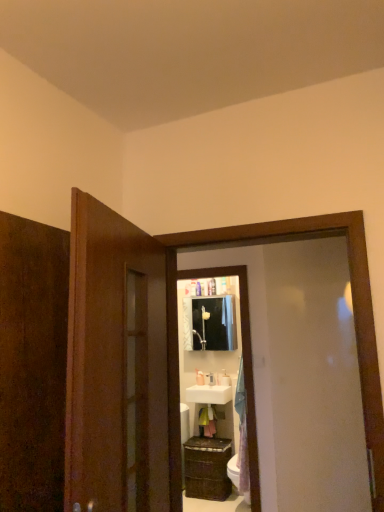
Question: Considering the positions of matte white medicine cabinet at center and white glossy sink at center in the image, is matte white medicine cabinet at center wider or thinner than white glossy sink at center?

Choices:
 (A) thin
 (B) wide

Answer: (A)

Question: From their relative heights in the image, would you say matte white medicine cabinet at center is taller or shorter than white glossy sink at center?

Choices:
 (A) tall
 (B) short

Answer: (A)

Question: Based on their relative distances, which object is farther from the white glossy toothbrush at upper center, which is counted as the third toiletry, starting from the left?

Choices:
 (A) white glossy soap dispenser at center, the 1th toiletry in the left-to-right sequence
 (B) white glossy sink at center
 (C) white glossy soap dispenser at center, placed as the second toiletry when sorted from left to right
 (D) matte white medicine cabinet at center
 (E) white glossy toilet bowl at lower right

Answer: (E)

Question: Which of these objects is positioned closest to the white glossy sink at center?

Choices:
 (A) white glossy toilet bowl at lower right
 (B) wooden cabinet at lower center
 (C) white glossy soap dispenser at center, acting as the 3th toiletry starting from the right
 (D) matte white medicine cabinet at center
 (E) white glossy soap dispenser at center, placed as the second toiletry when sorted from left to right

Answer: (E)